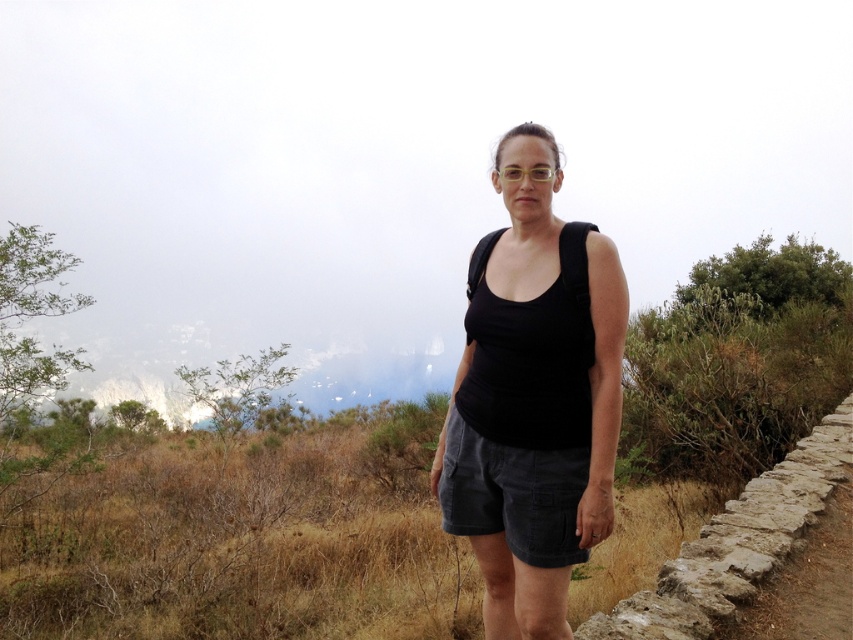
Consider the image. You are a photographer trying to capture the black fabric vest at center and dark gray corduroy shorts at center in a single shot. Since the vest and shorts are layered, which one will appear closer to the camera in the photo?

The black fabric vest at center will appear closer to the camera because the dark gray corduroy shorts at center is behind it.

In the scene shown: You are a photographer trying to capture the brown dry grass at lower center and the dark gray corduroy shorts at center in the same frame. Based on their positions, which object would you adjust your camera to focus on first if you want both to be in focus?

The brown dry grass at lower center is positioned on the left side of the dark gray corduroy shorts at center. To ensure both are in focus, adjust your camera to focus on the dark gray corduroy shorts at center first since it is closer to the center of the frame, making it easier to include both objects within the depth of field.

You are a photographer trying to capture the scene of a person on a hiking trail. You notice the brown dry grass at lower center and the dark gray corduroy shorts at center. Which object is positioned lower in the image?

The brown dry grass at lower center is positioned lower than the dark gray corduroy shorts at center in the image.